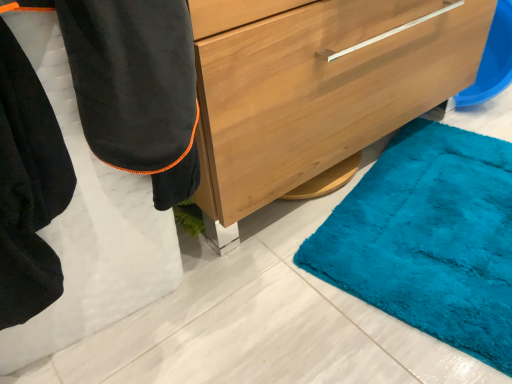
Find the location of a particular element. Image resolution: width=512 pixels, height=384 pixels. wooden chest of drawers at center is located at coordinates (322, 90).

Describe the element at coordinates (322, 90) in the screenshot. I see `wooden chest of drawers at center` at that location.

Describe the element at coordinates (86, 153) in the screenshot. Image resolution: width=512 pixels, height=384 pixels. I see `black fleece robe at lower left` at that location.

This screenshot has height=384, width=512. I want to click on black fleece robe at lower left, so click(x=86, y=153).

This screenshot has width=512, height=384. In order to click on wooden chest of drawers at center in this screenshot , I will do `click(322, 90)`.

Considering the relative positions of wooden chest of drawers at center and black fleece robe at lower left in the image provided, is wooden chest of drawers at center to the left or to the right of black fleece robe at lower left?

In the image, wooden chest of drawers at center appears on the right side of black fleece robe at lower left.

Between wooden chest of drawers at center and black fleece robe at lower left, which one is positioned in front?

black fleece robe at lower left is in front.

Considering the positions of point (369, 99) and point (1, 361), is point (369, 99) closer or farther from the camera than point (1, 361)?

Point (369, 99).

From the image's perspective, between wooden chest of drawers at center and black fleece robe at lower left, who is located below?

black fleece robe at lower left appears lower in the image.

From a real-world perspective, between wooden chest of drawers at center and black fleece robe at lower left, who is vertically higher?

black fleece robe at lower left.

Does wooden chest of drawers at center have a greater width compared to black fleece robe at lower left?

In fact, wooden chest of drawers at center might be narrower than black fleece robe at lower left.

Considering the sizes of wooden chest of drawers at center and black fleece robe at lower left in the image, is wooden chest of drawers at center taller or shorter than black fleece robe at lower left?

wooden chest of drawers at center is shorter than black fleece robe at lower left.

Considering the sizes of objects wooden chest of drawers at center and black fleece robe at lower left in the image provided, who is smaller, wooden chest of drawers at center or black fleece robe at lower left?

With smaller size is black fleece robe at lower left.

Is wooden chest of drawers at center not within black fleece robe at lower left?

That's correct, wooden chest of drawers at center is outside of black fleece robe at lower left.

Is wooden chest of drawers at center placed right next to black fleece robe at lower left?

wooden chest of drawers at center and black fleece robe at lower left are not in contact.

Could you tell me if wooden chest of drawers at center is turned towards black fleece robe at lower left?

No, wooden chest of drawers at center is not oriented towards black fleece robe at lower left.

This screenshot has height=384, width=512. Find the location of `chest of drawers below the black fleece robe at lower left (from a real-world perspective)`. chest of drawers below the black fleece robe at lower left (from a real-world perspective) is located at coordinates (322, 90).

Is black fleece robe at lower left at the right side of wooden chest of drawers at center?

No.

Who is more distant, black fleece robe at lower left or wooden chest of drawers at center?

wooden chest of drawers at center is further away from the camera.

Considering the points (65, 41) and (280, 15), which point is behind, point (65, 41) or point (280, 15)?

The point (280, 15) is behind.

From the image's perspective, is black fleece robe at lower left above or below wooden chest of drawers at center?

Clearly, from the image's perspective, black fleece robe at lower left is below wooden chest of drawers at center.

From a real-world perspective, which is physically above, black fleece robe at lower left or wooden chest of drawers at center?

black fleece robe at lower left, from a real-world perspective.

Does black fleece robe at lower left have a lesser width compared to wooden chest of drawers at center?

No.

Between black fleece robe at lower left and wooden chest of drawers at center, which one has more height?

black fleece robe at lower left is taller.

Which of these two, black fleece robe at lower left or wooden chest of drawers at center, is smaller?

Smaller between the two is black fleece robe at lower left.

In the scene shown: Is black fleece robe at lower left inside or outside of wooden chest of drawers at center?

black fleece robe at lower left exists outside the volume of wooden chest of drawers at center.

Is black fleece robe at lower left not near wooden chest of drawers at center?

No, black fleece robe at lower left is not far from wooden chest of drawers at center.

Is black fleece robe at lower left oriented towards wooden chest of drawers at center?

No, black fleece robe at lower left is not turned towards wooden chest of drawers at center.

How different are the orientations of black fleece robe at lower left and wooden chest of drawers at center in degrees?

There is a 0.286-degree angle between the facing directions of black fleece robe at lower left and wooden chest of drawers at center.

You are a GUI agent. You are given a task and a screenshot of the screen. Output one action in this format:
    pyautogui.click(x=<x>, y=<y>)
    Task: Click on the robe that is below the wooden chest of drawers at center (from the image's perspective)
    The height and width of the screenshot is (384, 512).
    Given the screenshot: What is the action you would take?
    pyautogui.click(x=86, y=153)

The width and height of the screenshot is (512, 384). I want to click on chest of drawers on the right of black fleece robe at lower left, so click(322, 90).

What are the coordinates of `chest of drawers above the black fleece robe at lower left (from the image's perspective)` in the screenshot? It's located at (322, 90).